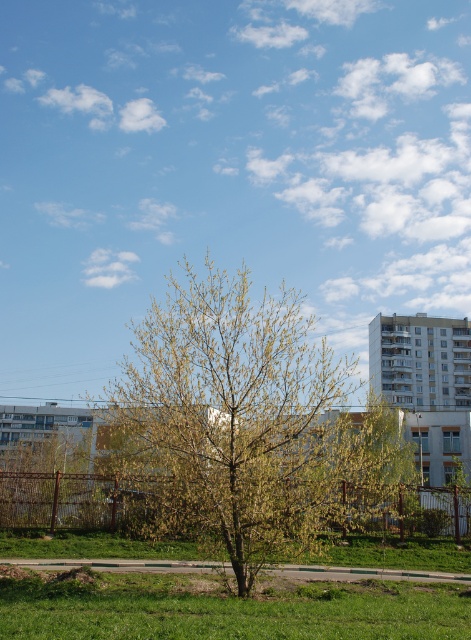
You are standing in the park and want to take a photo of the green leafy tree at center and the green grassy at lower center. Which object should you focus on first to ensure both are in the frame?

You should focus on the green leafy tree at center first because it is closer to you than the green grassy at lower center, ensuring both are in the frame.

You are standing in an urban park and want to take a photo of the green leafy tree at center. If your camera has a maximum focus range of 10 meters, will you need to adjust your position to capture the tree clearly?

The green leafy tree at center is 10.23 meters from camera, which exceeds the camera maximum focus range of 10 meters. You need to move closer to the tree to ensure it is in focus.

From the picture: You are standing at the center of the image and want to take a photo of the green leafy tree at center. In which direction should you move to frame the tree perfectly in the center of your camera view?

Since the green leafy tree at center is already located at the center of the image, you don not need to move. The tree is already perfectly framed in the center of the camera view.